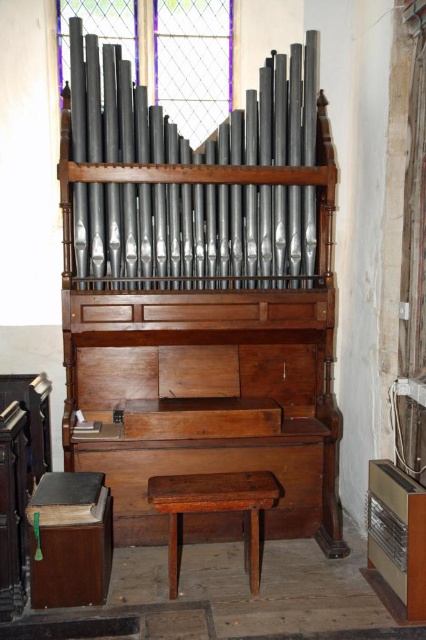
Measure the distance between matte black pipes at center and camera.

3.30 meters

Does matte black pipes at center have a larger size compared to dark brown wood stool at center?

Yes.

Where is `matte black pipes at center`? matte black pipes at center is located at coordinates (192, 180).

The image size is (426, 640). What are the coordinates of `matte black pipes at center` in the screenshot? It's located at (192, 180).